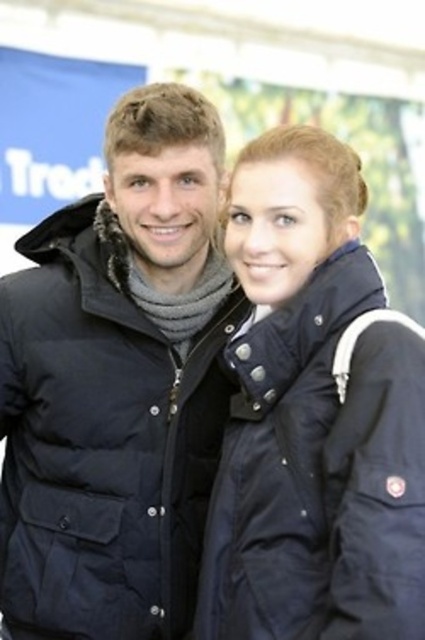
Which of these two, matte black jacket at center or navy blue down jacket at center, stands taller?

matte black jacket at center

Is matte black jacket at center to the left of navy blue down jacket at center from the viewer's perspective?

Indeed, matte black jacket at center is positioned on the left side of navy blue down jacket at center.

Which is in front, point (135, 376) or point (258, 506)?

Point (258, 506) is in front.

This screenshot has height=640, width=425. In order to click on matte black jacket at center in this screenshot , I will do `click(102, 444)`.